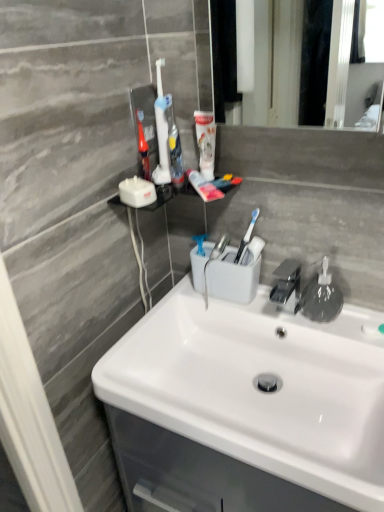
Question: From a real-world perspective, is white glossy sink at center positioned above or below transparent plastic soap dispenser at right?

Choices:
 (A) above
 (B) below

Answer: (B)

Question: Would you say white glossy sink at center is to the left or to the right of transparent plastic soap dispenser at right in the picture?

Choices:
 (A) right
 (B) left

Answer: (B)

Question: Based on their relative distances, which object is nearer to the white plastic toothbrush at upper center, placed as the third toothbrush when sorted from left to right?

Choices:
 (A) transparent plastic soap dispenser at right
 (B) white glossy sink at center
 (C) white plastic toothbrush at upper center, the second toothbrush positioned from the right
 (D) translucent plastic toothbrush at upper center, which ranks as the 3th toothbrush in right-to-left order
 (E) white glossy toothpaste tube at upper center

Answer: (C)

Question: Estimate the real-world distances between objects in this image. Which object is farther from the white glossy sink at center?

Choices:
 (A) transparent plastic soap dispenser at right
 (B) white plastic toothbrush at upper center, placed as the third toothbrush when sorted from left to right
 (C) white plastic toothbrush at upper center, the second toothbrush from the left
 (D) translucent plastic toothbrush at upper center, the 1th toothbrush when ordered from left to right
 (E) white glossy toothpaste tube at upper center

Answer: (D)